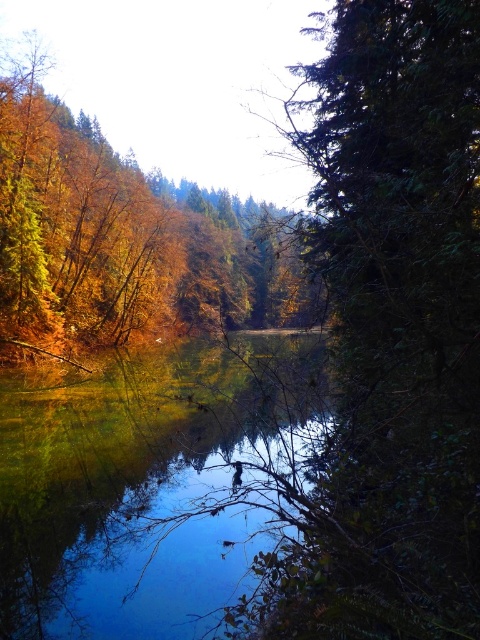
Question: Can you confirm if green matte tree at right is thinner than shiny reflective water at center?

Choices:
 (A) no
 (B) yes

Answer: (B)

Question: Does green matte tree at right have a smaller size compared to shiny reflective water at center?

Choices:
 (A) yes
 (B) no

Answer: (A)

Question: Which of the following is the farthest from the observer?

Choices:
 (A) (394, 516)
 (B) (94, 564)

Answer: (B)

Question: Is green matte tree at right positioned before shiny reflective water at center?

Choices:
 (A) no
 (B) yes

Answer: (B)

Question: Among these points, which one is nearest to the camera?

Choices:
 (A) (84, 488)
 (B) (454, 42)

Answer: (B)